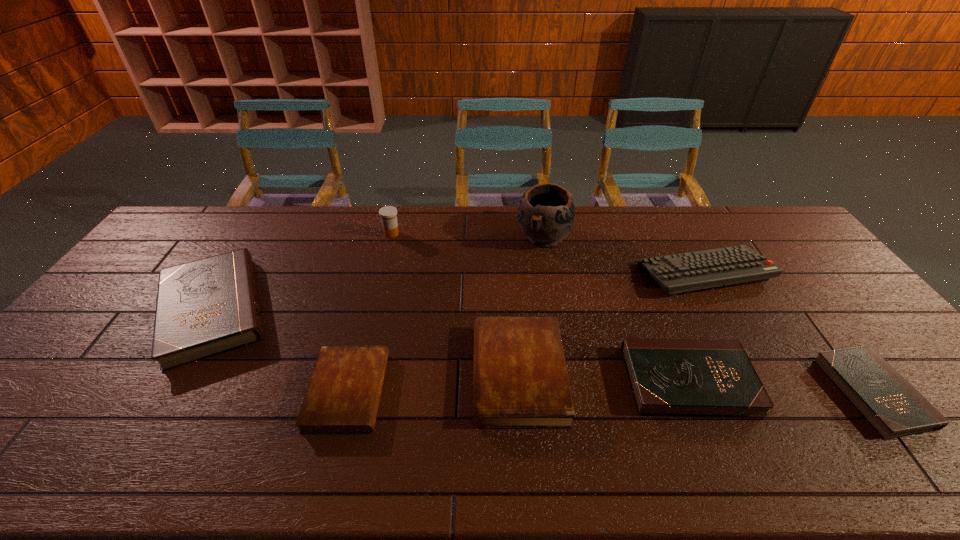
Image resolution: width=960 pixels, height=540 pixels. I want to click on vacant space located 0.380m on the spine side of the right reddish-brown Bible, so click(x=324, y=374).

The image size is (960, 540). What are the coordinates of `vacant space located 0.170m on the spine side of the right reddish-brown Bible` in the screenshot? It's located at (407, 374).

Where is `vacant point located 0.150m on the back of the second green Bible from left to right`? The image size is (960, 540). vacant point located 0.150m on the back of the second green Bible from left to right is located at coordinates (659, 308).

You are a GUI agent. You are given a task and a screenshot of the screen. Output one action in this format:
    pyautogui.click(x=<x>, y=<y>)
    Task: Click on the free spot located 0.120m on the spine side of the smaller reddish-brown Bible
    
    Given the screenshot: What is the action you would take?
    pyautogui.click(x=432, y=392)

This screenshot has height=540, width=960. I want to click on vacant area located 0.270m on the back of the rightmost green Bible, so click(x=789, y=284).

This screenshot has height=540, width=960. In order to click on pottery that is at the far edge in this screenshot , I will do `click(546, 213)`.

Identify the location of medicine that is positioned at the far edge. Image resolution: width=960 pixels, height=540 pixels. (388, 214).

This screenshot has width=960, height=540. I want to click on object at the near edge, so click(890, 404).

At what (x,y) coordinates should I click in order to perform the action: click on object at the left edge. Please return your answer as a coordinate pair (x, y). Image resolution: width=960 pixels, height=540 pixels. Looking at the image, I should click on (206, 307).

The height and width of the screenshot is (540, 960). I want to click on object at the right edge, so click(x=890, y=404).